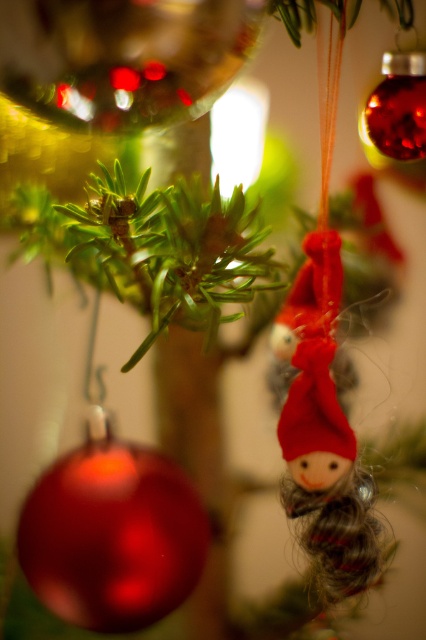
Is glossy red bauble at center positioned before matte red fabric doll at center?

Yes, glossy red bauble at center is in front of matte red fabric doll at center.

Who is more forward, (57, 500) or (311, 525)?

Point (57, 500) is in front.

Measure the distance between point (189, 582) and camera.

Point (189, 582) is 74.75 centimeters away from camera.

You are a GUI agent. You are given a task and a screenshot of the screen. Output one action in this format:
    pyautogui.click(x=<x>, y=<y>)
    Task: Click on the glossy red bauble at center
    The image size is (426, 640).
    Given the screenshot: What is the action you would take?
    pyautogui.click(x=112, y=534)